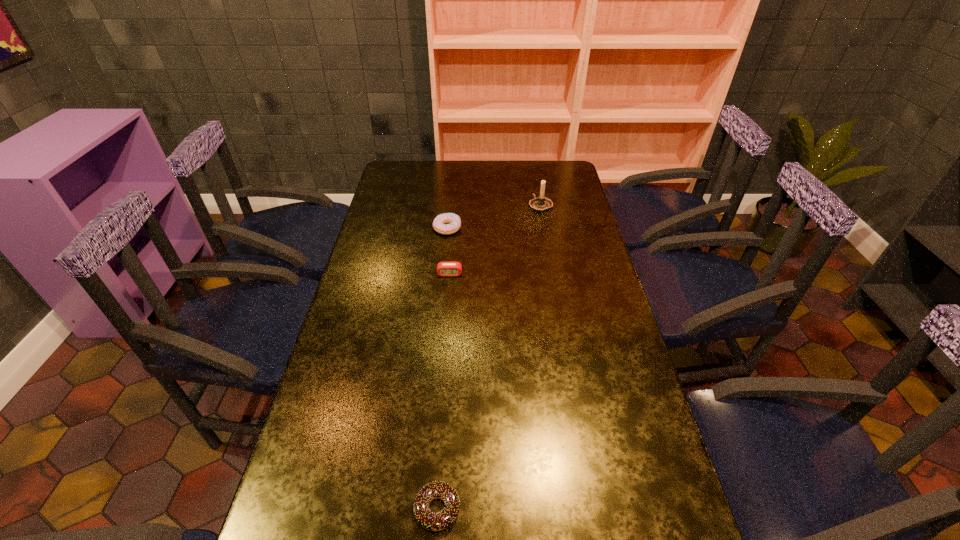
This screenshot has height=540, width=960. I want to click on vacant region located on the back of the shortest object, so click(x=443, y=434).

At what (x,y) coordinates should I click in order to perform the action: click on object that is at the right edge. Please return your answer as a coordinate pair (x, y). The height and width of the screenshot is (540, 960). Looking at the image, I should click on click(x=540, y=204).

Locate an element on the screen. free region at the far edge is located at coordinates [x=514, y=166].

The image size is (960, 540). Find the location of `vacant region at the left edge of the desktop`. vacant region at the left edge of the desktop is located at coordinates (313, 452).

This screenshot has height=540, width=960. In order to click on blank space at the right edge in this screenshot , I will do `click(605, 458)`.

You are a GUI agent. You are given a task and a screenshot of the screen. Output one action in this format:
    pyautogui.click(x=<x>, y=<y>)
    Task: Click on the vacant space at the far left corner of the desktop
    The height and width of the screenshot is (540, 960).
    Given the screenshot: What is the action you would take?
    415,175

Identify the location of free point between the shortest object and the farthest object. (489, 357).

Where is `vacant region between the farther doughnut and the shorter doughnut`? vacant region between the farther doughnut and the shorter doughnut is located at coordinates (443, 368).

Locate an element on the screen. empty space between the tallest object and the nearest object is located at coordinates pos(489,357).

The width and height of the screenshot is (960, 540). Identify the location of unoccupied area between the second farthest object and the third farthest object. (448, 251).